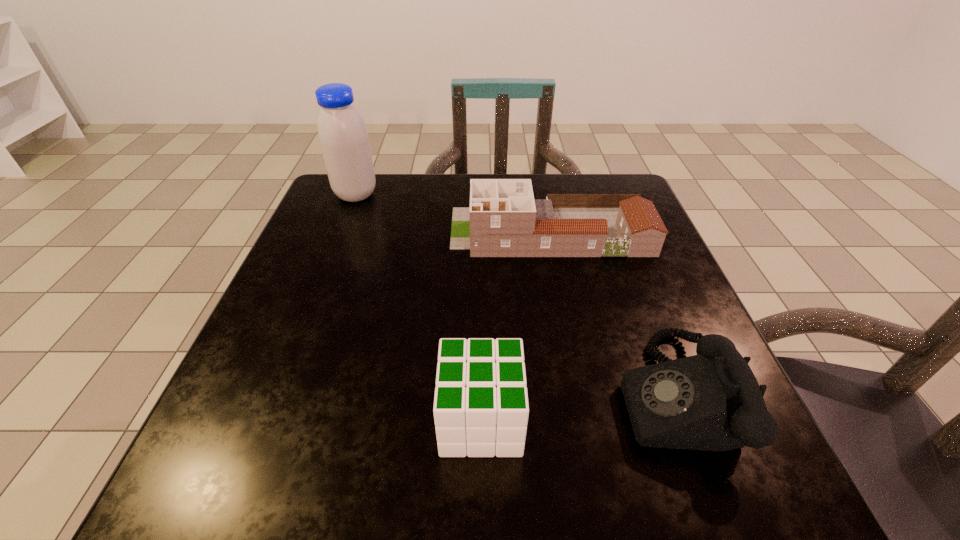
Select which object appears as the closest to the soya milk. Please provide its 2D coordinates. Your answer should be formatted as a tuple, i.e. [(x, y)], where the tuple contains the x and y coordinates of a point satisfying the conditions above.

[(503, 220)]

Identify the location of the second closest object to the farthest object. (481, 408).